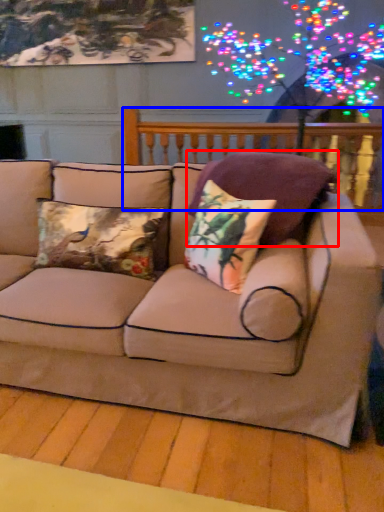
Question: Among these objects, which one is nearest to the camera, pillow (highlighted by a red box) or balustrade (highlighted by a blue box)?

Choices:
 (A) pillow
 (B) balustrade

Answer: (A)